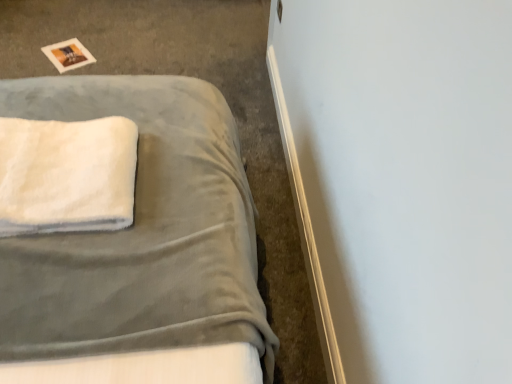
Question: Does white fluffy towel at upper left have a lesser width compared to suede gray bed at upper left?

Choices:
 (A) yes
 (B) no

Answer: (A)

Question: Is white fluffy towel at upper left shorter than suede gray bed at upper left?

Choices:
 (A) no
 (B) yes

Answer: (A)

Question: Is there a large distance between white fluffy towel at upper left and suede gray bed at upper left?

Choices:
 (A) yes
 (B) no

Answer: (B)

Question: From a real-world perspective, does white fluffy towel at upper left stand above suede gray bed at upper left?

Choices:
 (A) yes
 (B) no

Answer: (A)

Question: Considering the relative sizes of white fluffy towel at upper left and suede gray bed at upper left in the image provided, is white fluffy towel at upper left wider than suede gray bed at upper left?

Choices:
 (A) no
 (B) yes

Answer: (A)

Question: From the image's perspective, is white fluffy towel at upper left on top of suede gray bed at upper left?

Choices:
 (A) yes
 (B) no

Answer: (B)

Question: Is suede gray bed at upper left looking in the opposite direction of white fluffy towel at upper left?

Choices:
 (A) yes
 (B) no

Answer: (B)

Question: From a real-world perspective, is suede gray bed at upper left located beneath white fluffy towel at upper left?

Choices:
 (A) yes
 (B) no

Answer: (A)

Question: Considering the relative positions of suede gray bed at upper left and white fluffy towel at upper left in the image provided, is suede gray bed at upper left to the right of white fluffy towel at upper left from the viewer's perspective?

Choices:
 (A) no
 (B) yes

Answer: (A)

Question: From the image's perspective, does suede gray bed at upper left appear higher than white fluffy towel at upper left?

Choices:
 (A) yes
 (B) no

Answer: (A)

Question: From the image's perspective, does suede gray bed at upper left appear lower than white fluffy towel at upper left?

Choices:
 (A) no
 (B) yes

Answer: (A)

Question: Is suede gray bed at upper left far away from white fluffy towel at upper left?

Choices:
 (A) yes
 (B) no

Answer: (B)

Question: Is white fluffy towel at upper left in front of or behind suede gray bed at upper left in the image?

Choices:
 (A) front
 (B) behind

Answer: (A)